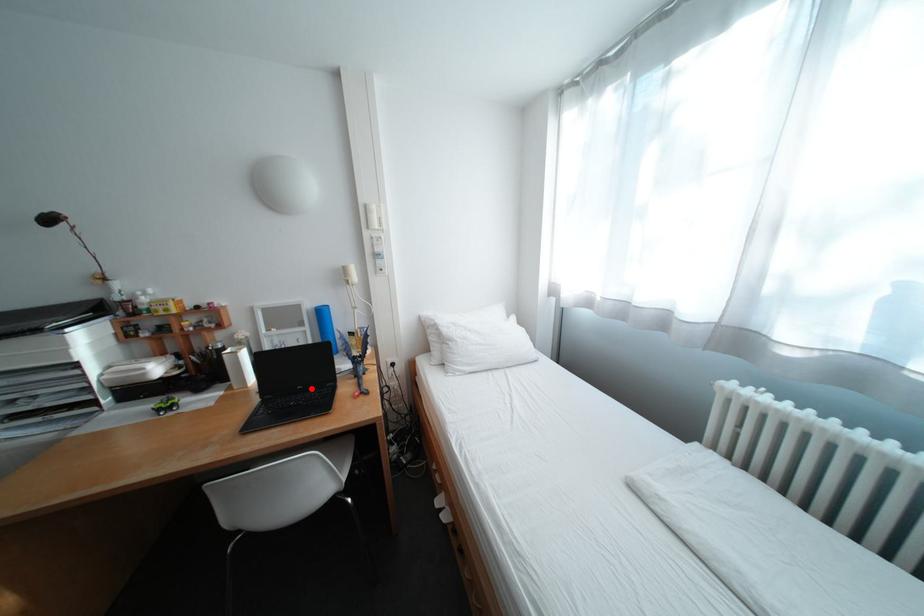
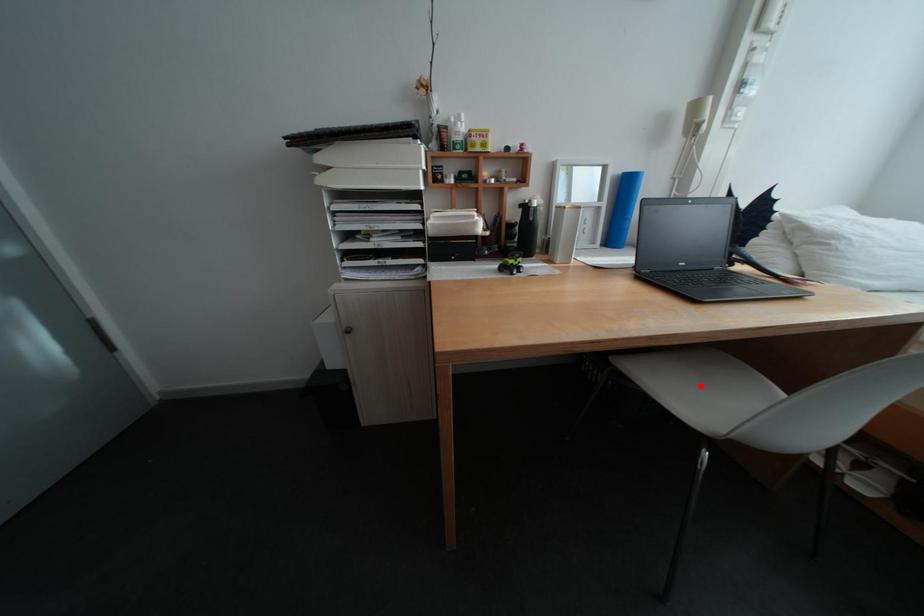
I am providing you with two images of the same scene from different viewpoints. A red point is marked on the first image and another point is marked on the second image. Is the marked point in image1 the same physical position as the marked point in image2?

No